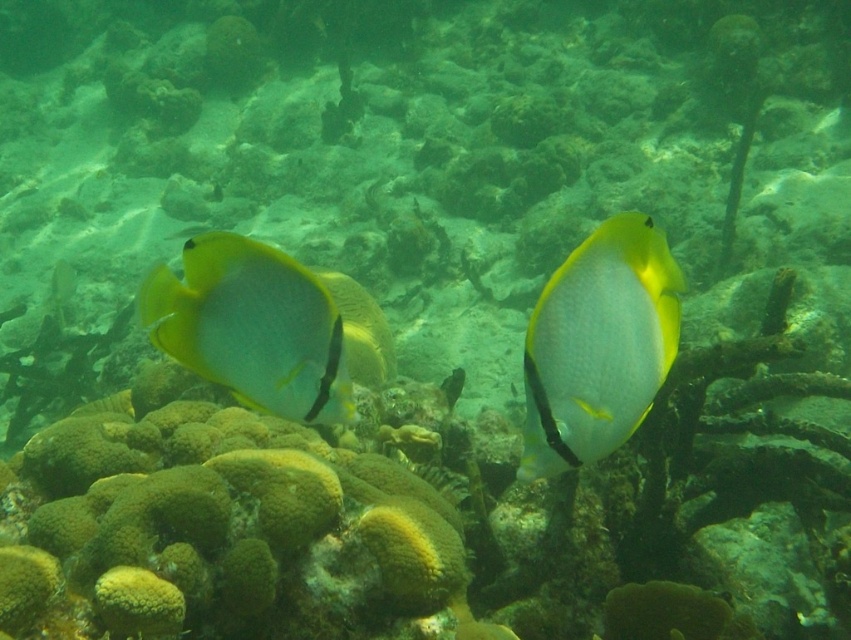
Based on the photo, can you confirm if shiny yellow fish at center is positioned below translucent yellow fish at center?

Yes, shiny yellow fish at center is below translucent yellow fish at center.

Is shiny yellow fish at center further to the viewer compared to translucent yellow fish at center?

No, it is in front of translucent yellow fish at center.

What are the coordinates of `shiny yellow fish at center` in the screenshot? It's located at (598, 346).

Identify the location of shiny yellow fish at center. (598, 346).